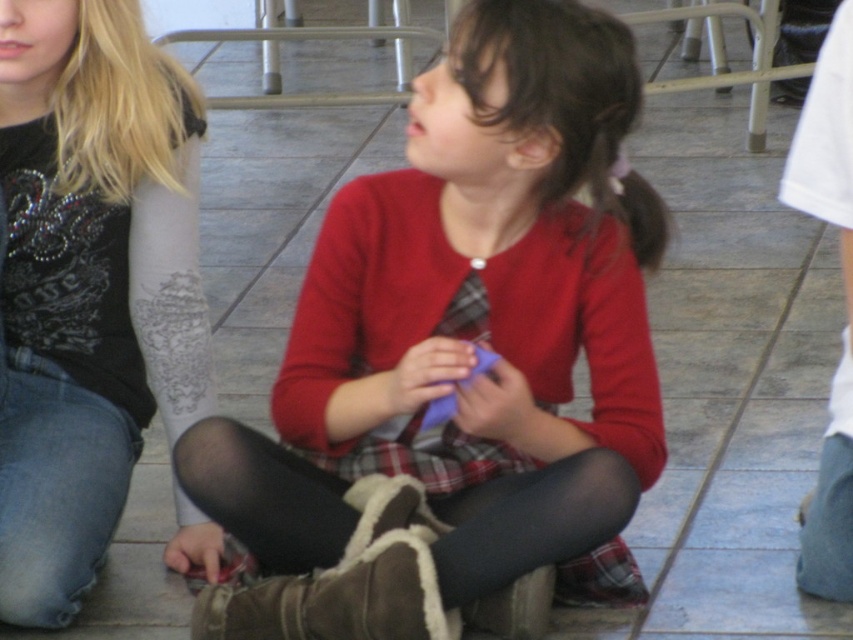
Where is the matte red sweater at center located in the image?

The matte red sweater at center is located at point coordinates of (471, 326).

You are a photographer setting up a shoot. You need to position a camera so that both the matte red sweater at center and the matte black shirt at left are in frame. Based on their positions, which object should you place the camera closer to in order to capture both subjects without moving them?

The matte red sweater at center is to the right of the matte black shirt at left. To capture both in frame, the camera should be positioned closer to the matte black shirt at left since it is on the left side, allowing the camera to encompass both the left and right positioned subjects.

You are organizing a clothing donation drive and need to determine if the matte red sweater at center and the matte black shirt at left can fit side by side on a shelf that is 1.2 meters wide. Based on their widths, will they both fit?

The matte red sweater at center might be wider than the matte black shirt at left. Since the total width of both items combined could exceed 1.2 meters, it is uncertain if they will fit without more precise measurements.